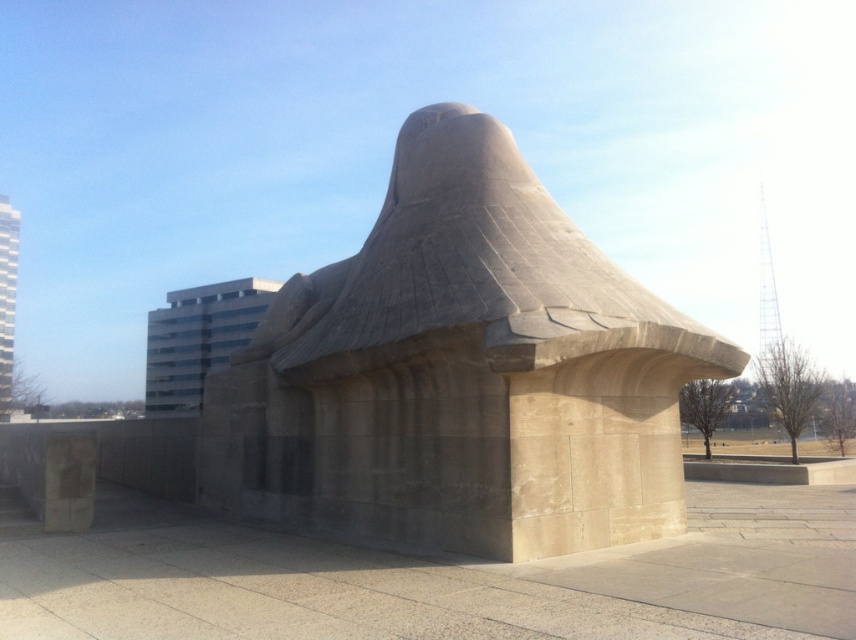
You are an architect visiting this site and need to install a new light fixture between the smooth concrete sculpture at center and the beige stone wall at center. The light fixture requires a minimum of 2 meters of space to be safely installed. Can the space between them accommodate the light fixture?

The smooth concrete sculpture at center and the beige stone wall at center are 2.28 meters apart, which is more than the required 2 meters, so the space can accommodate the light fixture safely.

You are an architect visiting the site and need to determine which object is taller between the smooth concrete sculpture at center and the beige stone wall at center. Based on the scene, which one is taller?

The smooth concrete sculpture at center is much taller than the beige stone wall at center.

You are standing in front of the modern architectural structure described. There is a specific point marked at coordinates point (461,372). What does this point indicate?

The point (461,372) marks the location of the smooth concrete sculpture at center.